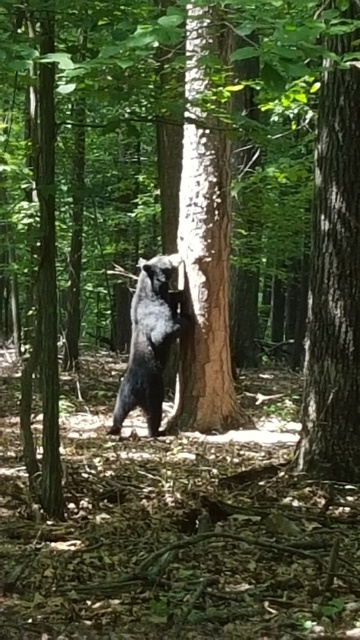
You are a hiker in the forest and want to place a small marker between the two points, point (335, 88) and point (200, 362). Which point should the marker be closer to if you want it to be nearer to the foreground of the image?

The marker should be placed closer to point (335, 88) because it is closer to the viewer than point (200, 362).

You are a wildlife photographer who wants to capture a photo of the shiny black bear at center. You have a camera mounted on a tripod placed near the smooth brown tree trunk at right. To get a clear shot, you need to know if the bear is shorter than the tree trunk. Can you confirm this?

The smooth brown tree trunk at right is taller than the shiny black bear at center, so yes, the bear is shorter than the tree trunk.

You are a hiker who has just entered the forest and see the smooth brown tree trunk at right and the brown rough tree trunk at center. Which tree trunk is higher up from the ground?

The smooth brown tree trunk at right is above the brown rough tree trunk at center, so it is higher up from the ground.